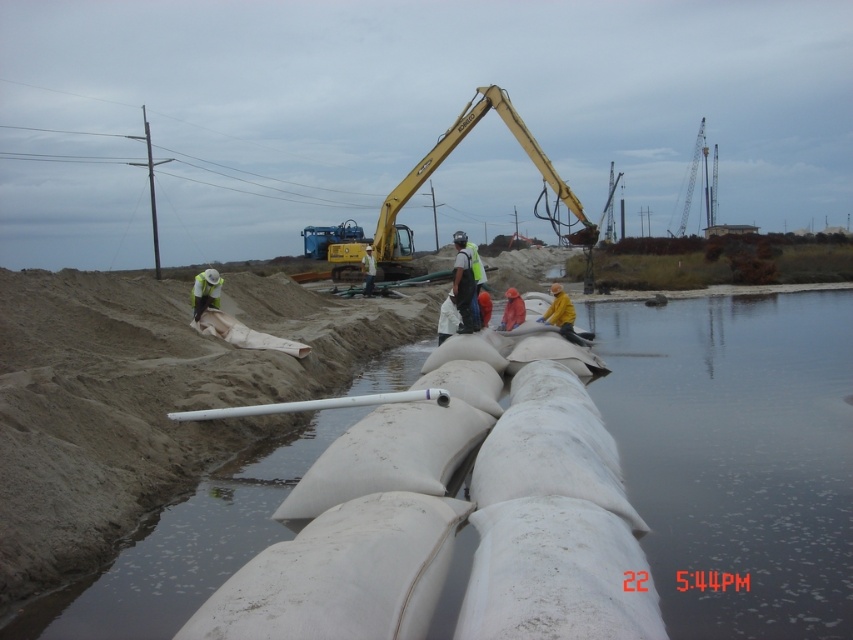
You are a safety inspector tasked with ensuring equipment and materials are appropriately sized for the job site. Given the yellow metallic excavator at center and the white matte pipe at center, which object would require more space to maneuver around or store on site?

The yellow metallic excavator at center requires more space to maneuver around or store on site because it has a larger size compared to the white matte pipe at center.